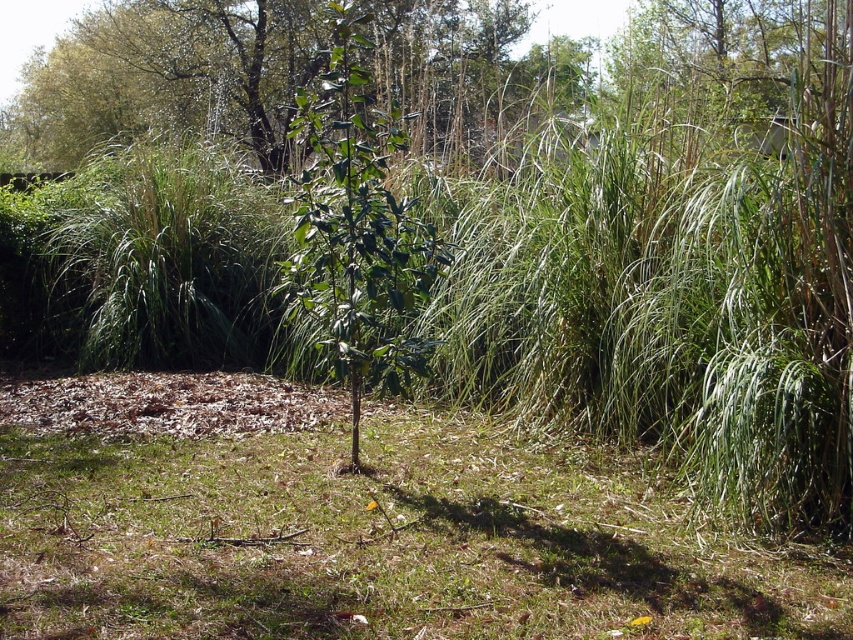
Does point (544, 586) come closer to viewer compared to point (308, 131)?

Yes, point (544, 586) is closer to viewer.

Which is more to the left, green grass at center or green glossy leafy plant at center?

green grass at center

Locate an element on the screen. green grass at center is located at coordinates (374, 540).

The image size is (853, 640). Identify the location of green grass at center. (374, 540).

Between point (260, 65) and point (340, 102), which one is positioned behind?

Point (260, 65)

Does green leafy plant at upper center appear on the left side of green glossy leafy plant at center?

Yes, green leafy plant at upper center is to the left of green glossy leafy plant at center.

Does point (270, 54) lie in front of point (361, 276)?

No, (270, 54) is behind (361, 276).

I want to click on green leafy plant at upper center, so click(167, 76).

Is point (379, 440) positioned after point (212, 26)?

No, it is in front of (212, 26).

Which of these two, green grass at center or green leafy plant at upper center, stands taller?

Standing taller between the two is green leafy plant at upper center.

Which is in front, point (196, 451) or point (259, 147)?

Positioned in front is point (196, 451).

This screenshot has width=853, height=640. Identify the location of green grass at center. (374, 540).